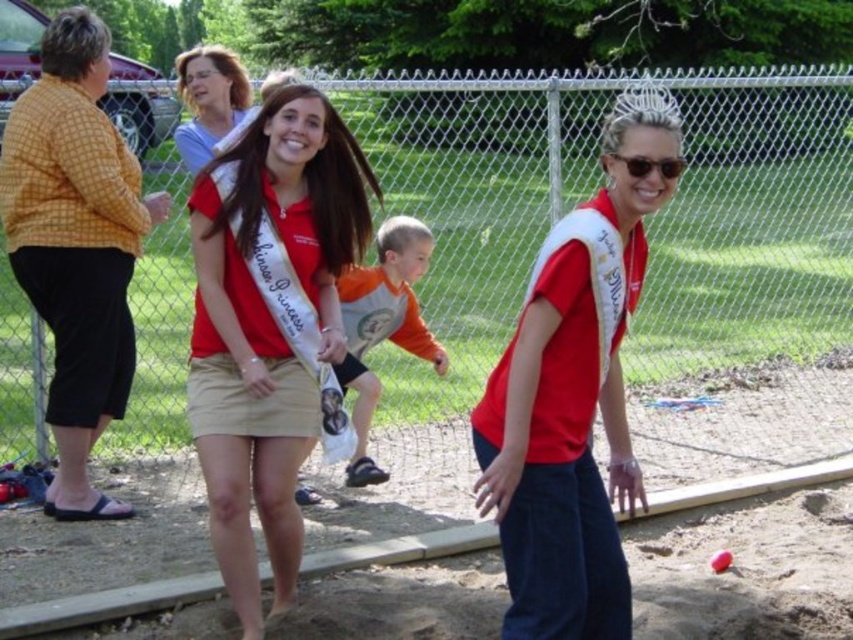
Can you confirm if matte red shirt at center is thinner than orange cotton shirt at center?

Indeed, matte red shirt at center has a lesser width compared to orange cotton shirt at center.

Is matte red shirt at center closer to camera compared to orange cotton shirt at center?

Yes, matte red shirt at center is in front of orange cotton shirt at center.

Is point (281, 483) positioned after point (412, 241)?

No, (281, 483) is in front of (412, 241).

Locate an element on the screen. This screenshot has height=640, width=853. matte red shirt at center is located at coordinates click(268, 328).

Is orange cotton shirt at center thinner than matte blue shirt at upper left?

Yes.

Can you confirm if orange cotton shirt at center is positioned below matte blue shirt at upper left?

Indeed, orange cotton shirt at center is positioned under matte blue shirt at upper left.

Looking at this image, who is more forward, [392,326] or [201,90]?

Point [201,90] is in front.

Where is `orange cotton shirt at center`? Image resolution: width=853 pixels, height=640 pixels. orange cotton shirt at center is located at coordinates (381, 326).

Which of these two, matte red sash at center or matte red shirt at center, stands shorter?

With less height is matte red sash at center.

At what (x,y) coordinates should I click in order to perform the action: click on matte red sash at center. Please return your answer as a coordinate pair (x, y). The image size is (853, 640). Looking at the image, I should click on (575, 392).

You are a GUI agent. You are given a task and a screenshot of the screen. Output one action in this format:
    pyautogui.click(x=<x>, y=<y>)
    Task: Click on the matte red sash at center
    The image size is (853, 640).
    Given the screenshot: What is the action you would take?
    pyautogui.click(x=575, y=392)